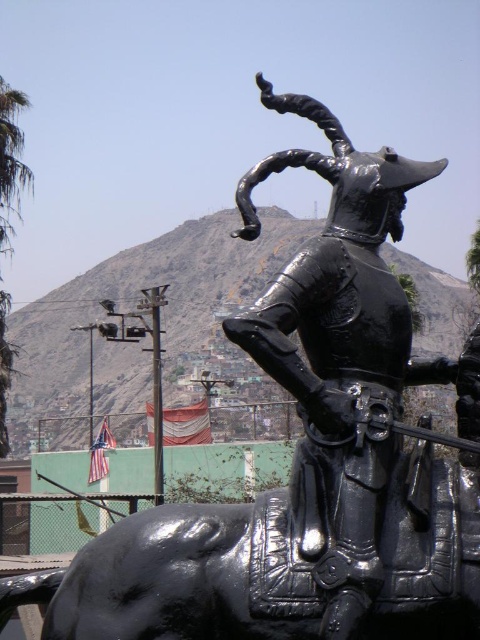
Question: Can you confirm if glossy black armor at center is smaller than green leafy palm tree at left?

Choices:
 (A) no
 (B) yes

Answer: (B)

Question: Can you confirm if glossy black armor at center is wider than green leafy palm tree at left?

Choices:
 (A) yes
 (B) no

Answer: (A)

Question: Is glossy black armor at center further to camera compared to green leafy palm tree at left?

Choices:
 (A) no
 (B) yes

Answer: (A)

Question: Which of the following is the closest to the observer?

Choices:
 (A) (309, 252)
 (B) (29, 184)

Answer: (A)